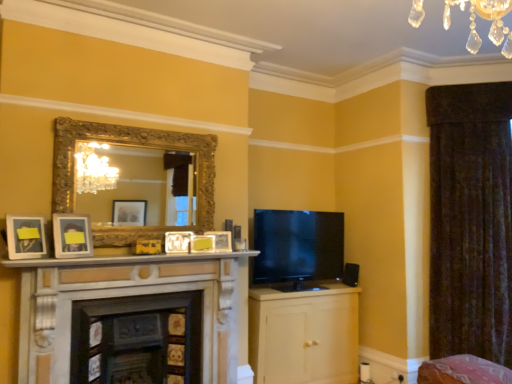
The width and height of the screenshot is (512, 384). What do you see at coordinates (139, 146) in the screenshot? I see `gold ornate mirror at upper center` at bounding box center [139, 146].

Find the location of a particular element. gold ornate mirror at upper center is located at coordinates (139, 146).

The height and width of the screenshot is (384, 512). What do you see at coordinates (297, 247) in the screenshot? I see `black glossy flat-screen tv at center-right` at bounding box center [297, 247].

Identify the location of matte cream cabinet at center-right. The image size is (512, 384). (304, 335).

What do you see at coordinates (470, 221) in the screenshot? I see `velvet dark brown curtain at right` at bounding box center [470, 221].

This screenshot has height=384, width=512. Find the location of `wooden fireplace at lower center, acting as the first fireplace starting from the left`. wooden fireplace at lower center, acting as the first fireplace starting from the left is located at coordinates (137, 339).

Where is `matte silver picture frame at left, which appears as the second picture frame when viewed from the left`? This screenshot has height=384, width=512. matte silver picture frame at left, which appears as the second picture frame when viewed from the left is located at coordinates (72, 235).

Identify the location of white glossy mantle at center. (124, 259).

In terms of height, does matte yellow picture frame at center, the fifth picture frame in the left-to-right sequence, look taller or shorter compared to wooden fireplace at lower center, the 2th fireplace from the right?

Clearly, matte yellow picture frame at center, the fifth picture frame in the left-to-right sequence, is shorter compared to wooden fireplace at lower center, the 2th fireplace from the right.

From a real-world perspective, between matte yellow picture frame at center, the second picture frame in the right-to-left sequence, and wooden fireplace at lower center, the 2th fireplace from the right, who is vertically higher?

matte yellow picture frame at center, the second picture frame in the right-to-left sequence, is physically above.

Visually, is matte yellow picture frame at center, the second picture frame in the right-to-left sequence, positioned to the left or to the right of wooden fireplace at lower center, the 2th fireplace from the right?

matte yellow picture frame at center, the second picture frame in the right-to-left sequence, is positioned on wooden fireplace at lower center, the 2th fireplace from the right,'s right side.

Do you think matte yellow picture frame at center, the second picture frame in the right-to-left sequence, is within wooden fireplace at lower center, the 2th fireplace from the right, or outside of it?

matte yellow picture frame at center, the second picture frame in the right-to-left sequence, is located beyond the bounds of wooden fireplace at lower center, the 2th fireplace from the right.

From their relative heights in the image, would you say marble fireplace at center, marked as the second fireplace in a left-to-right arrangement, is taller or shorter than black glossy flat-screen tv at center-right?

Clearly, marble fireplace at center, marked as the second fireplace in a left-to-right arrangement, is taller compared to black glossy flat-screen tv at center-right.

In the scene shown: From the image's perspective, would you say marble fireplace at center, which appears as the first fireplace when viewed from the right, is shown under black glossy flat-screen tv at center-right?

Indeed, from the image's perspective, marble fireplace at center, which appears as the first fireplace when viewed from the right, is shown beneath black glossy flat-screen tv at center-right.

Which point is more forward, (73, 274) or (265, 227)?

Point (73, 274)

Could you tell me if marble fireplace at center, marked as the second fireplace in a left-to-right arrangement, is facing black glossy flat-screen tv at center-right?

No, marble fireplace at center, marked as the second fireplace in a left-to-right arrangement, is not oriented towards black glossy flat-screen tv at center-right.

From a real-world perspective, is marble fireplace at center, marked as the second fireplace in a left-to-right arrangement, positioned over wooden fireplace at lower center, acting as the first fireplace starting from the left, based on gravity?

Yes.

Can you confirm if marble fireplace at center, which appears as the first fireplace when viewed from the right, is bigger than wooden fireplace at lower center, acting as the first fireplace starting from the left?

Indeed, marble fireplace at center, which appears as the first fireplace when viewed from the right, has a larger size compared to wooden fireplace at lower center, acting as the first fireplace starting from the left.

Could you measure the distance between marble fireplace at center, marked as the second fireplace in a left-to-right arrangement, and wooden fireplace at lower center, the 2th fireplace from the right?

The distance of marble fireplace at center, marked as the second fireplace in a left-to-right arrangement, from wooden fireplace at lower center, the 2th fireplace from the right, is 8.96 inches.

From the image's perspective, is marble fireplace at center, which appears as the first fireplace when viewed from the right, located above wooden fireplace at lower center, the 2th fireplace from the right?

Indeed, from the image's perspective, marble fireplace at center, which appears as the first fireplace when viewed from the right, is shown above wooden fireplace at lower center, the 2th fireplace from the right.

Based on the photo, does marble fireplace at center, which appears as the first fireplace when viewed from the right, touch matte cream cabinet at center-right?

marble fireplace at center, which appears as the first fireplace when viewed from the right, and matte cream cabinet at center-right are not in contact.

Is marble fireplace at center, marked as the second fireplace in a left-to-right arrangement, bigger than matte cream cabinet at center-right?

Actually, marble fireplace at center, marked as the second fireplace in a left-to-right arrangement, might be smaller than matte cream cabinet at center-right.

In terms of height, does marble fireplace at center, which appears as the first fireplace when viewed from the right, look taller or shorter compared to matte cream cabinet at center-right?

Clearly, marble fireplace at center, which appears as the first fireplace when viewed from the right, is taller compared to matte cream cabinet at center-right.

Does marble fireplace at center, marked as the second fireplace in a left-to-right arrangement, appear on the left side of matte cream cabinet at center-right?

Yes, marble fireplace at center, marked as the second fireplace in a left-to-right arrangement, is to the left of matte cream cabinet at center-right.

Which is closer, (x=203, y=235) or (x=424, y=368)?

Point (x=203, y=235) is farther from the camera than point (x=424, y=368).

Consider the image. Considering the sizes of matte yellow picture frame at center, the fifth picture frame in the left-to-right sequence, and pink fabric swivel chair at lower right in the image, is matte yellow picture frame at center, the fifth picture frame in the left-to-right sequence, taller or shorter than pink fabric swivel chair at lower right?

Clearly, matte yellow picture frame at center, the fifth picture frame in the left-to-right sequence, is shorter compared to pink fabric swivel chair at lower right.

Considering the relative sizes of matte yellow picture frame at center, the second picture frame in the right-to-left sequence, and pink fabric swivel chair at lower right in the image provided, is matte yellow picture frame at center, the second picture frame in the right-to-left sequence, bigger than pink fabric swivel chair at lower right?

Actually, matte yellow picture frame at center, the second picture frame in the right-to-left sequence, might be smaller than pink fabric swivel chair at lower right.

Is matte yellow picture frame at center, the second picture frame in the right-to-left sequence, positioned beyond the bounds of pink fabric swivel chair at lower right?

Yes.

Does point (141, 241) come farther from viewer compared to point (126, 264)?

Yes.

Consider the image. From the image's perspective, which one is positioned lower, matte silver picture frame at center, positioned as the 3th picture frame in left-to-right order, or white glossy mantle at center?

white glossy mantle at center, from the image's perspective.

Who is bigger, matte silver picture frame at center, the fourth picture frame in the right-to-left sequence, or white glossy mantle at center?

white glossy mantle at center is bigger.

Considering the positions of objects matte silver picture frame at center, the fourth picture frame in the right-to-left sequence, and white glossy mantle at center in the image provided, who is more to the left, matte silver picture frame at center, the fourth picture frame in the right-to-left sequence, or white glossy mantle at center?

white glossy mantle at center is more to the left.

Does matte white picture frame at center, arranged as the first picture frame when viewed from the right, have a lesser height compared to gold ornate mirror at upper center?

Indeed, matte white picture frame at center, arranged as the first picture frame when viewed from the right, has a lesser height compared to gold ornate mirror at upper center.

Choose the correct answer: Is matte white picture frame at center, the 6th picture frame viewed from the left, inside gold ornate mirror at upper center or outside it?

matte white picture frame at center, the 6th picture frame viewed from the left, cannot be found inside gold ornate mirror at upper center.

From a real-world perspective, is matte white picture frame at center, arranged as the first picture frame when viewed from the right, located beneath gold ornate mirror at upper center?

Yes, from a real-world perspective, matte white picture frame at center, arranged as the first picture frame when viewed from the right, is below gold ornate mirror at upper center.

Is matte white picture frame at center, arranged as the first picture frame when viewed from the right, far away from gold ornate mirror at upper center?

No, matte white picture frame at center, arranged as the first picture frame when viewed from the right, is not far from gold ornate mirror at upper center.

The image size is (512, 384). Identify the location of the 3rd picture frame positioned above the wooden fireplace at lower center, acting as the first fireplace starting from the left (from the image's perspective). (202, 243).

From the image's perspective, which fireplace is the 1st one below the black glossy flat-screen tv at center-right? Please provide its 2D coordinates.

[(131, 295)]

Which object lies further to the anchor point matte cream cabinet at center-right, matte white picture frame at center, arranged as the first picture frame when viewed from the right, or velvet dark brown curtain at right?

Among the two, velvet dark brown curtain at right is located further to matte cream cabinet at center-right.

Estimate the real-world distances between objects in this image. Which object is further from matte silver picture frame at center, positioned as the 3th picture frame in left-to-right order, velvet dark brown curtain at right or matte white picture frame at center, placed as the third picture frame when sorted from right to left?

velvet dark brown curtain at right is positioned further to the anchor matte silver picture frame at center, positioned as the 3th picture frame in left-to-right order.

Estimate the real-world distances between objects in this image. Which object is further from matte white picture frame at lower left, the first picture frame when ordered from left to right, gold ornate mirror at upper center or matte cream cabinet at center-right?

matte cream cabinet at center-right.

Considering their positions, is matte silver picture frame at center, the fourth picture frame in the right-to-left sequence, positioned closer to pink fabric swivel chair at lower right than marble fireplace at center, which appears as the first fireplace when viewed from the right?

marble fireplace at center, which appears as the first fireplace when viewed from the right.

Which object lies nearer to the anchor point matte white picture frame at center, arranged as the first picture frame when viewed from the right, matte silver picture frame at left, which appears as the second picture frame when viewed from the left, or matte silver picture frame at center, the fourth picture frame in the right-to-left sequence?

Among the two, matte silver picture frame at center, the fourth picture frame in the right-to-left sequence, is located nearer to matte white picture frame at center, arranged as the first picture frame when viewed from the right.

Which object lies nearer to the anchor point velvet dark brown curtain at right, matte cream cabinet at center-right or matte white picture frame at lower left, the first picture frame when ordered from left to right?

matte cream cabinet at center-right is closer to velvet dark brown curtain at right.

When comparing their distances from matte white picture frame at center, the 4th picture frame in the left-to-right sequence, does wooden fireplace at lower center, acting as the first fireplace starting from the left, or matte silver picture frame at center, positioned as the 3th picture frame in left-to-right order, seem further?

The object further to matte white picture frame at center, the 4th picture frame in the left-to-right sequence, is wooden fireplace at lower center, acting as the first fireplace starting from the left.

When comparing their distances from matte white picture frame at center, the 6th picture frame viewed from the left, does matte white picture frame at lower left, the first picture frame when ordered from left to right, or wooden fireplace at lower center, acting as the first fireplace starting from the left, seem closer?

wooden fireplace at lower center, acting as the first fireplace starting from the left.

The image size is (512, 384). Identify the location of mirror situated between matte silver picture frame at left, which is the 5th picture frame from right to left, and velvet dark brown curtain at right from left to right. (139, 146).

What are the coordinates of `fireplace between wooden fireplace at lower center, the 2th fireplace from the right, and black glossy flat-screen tv at center-right` in the screenshot? It's located at (131, 295).

You are a GUI agent. You are given a task and a screenshot of the screen. Output one action in this format:
    pyautogui.click(x=<x>, y=<y>)
    Task: Click on the fireplace between matte yellow picture frame at center, the second picture frame in the right-to-left sequence, and wooden fireplace at lower center, the 2th fireplace from the right, from top to bottom
    
    Given the screenshot: What is the action you would take?
    pyautogui.click(x=131, y=295)

Find the location of `mantle between matte white picture frame at lower left, which appears as the 6th picture frame when viewed from the right, and matte silver picture frame at center, the fourth picture frame in the right-to-left sequence, from left to right`. mantle between matte white picture frame at lower left, which appears as the 6th picture frame when viewed from the right, and matte silver picture frame at center, the fourth picture frame in the right-to-left sequence, from left to right is located at coordinates (124, 259).